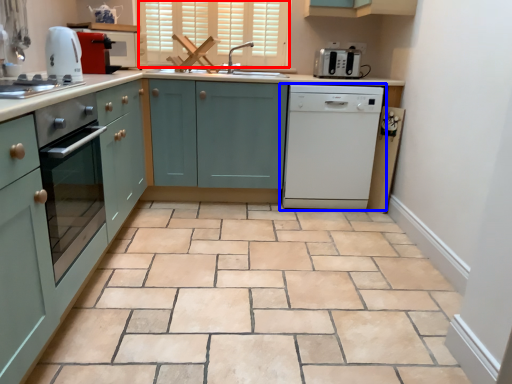
Question: Among these objects, which one is farthest to the camera, window (highlighted by a red box) or home appliance (highlighted by a blue box)?

Choices:
 (A) window
 (B) home appliance

Answer: (A)